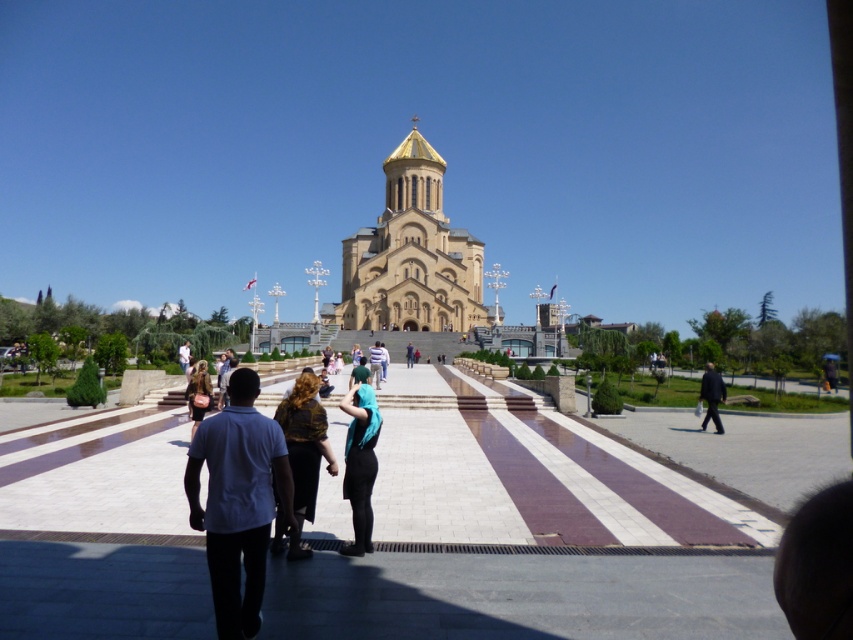
Question: Does gold textured dress at center appear over dark blue fabric jacket at center?

Choices:
 (A) yes
 (B) no

Answer: (B)

Question: In this image, where is beige stone church at center located relative to white cotton shirt at center?

Choices:
 (A) above
 (B) below

Answer: (A)

Question: Considering the real-world distances, which object is farthest from the dark blue fabric jacket at center?

Choices:
 (A) gold textured dress at center
 (B) beige stone church at center

Answer: (A)

Question: Which is farther from the dark blue fabric jacket at center?

Choices:
 (A) white cotton shirt at center
 (B) black suit at right
 (C) striped shirt at center

Answer: (A)

Question: Is the position of matte black dress at center less distant than that of light brown leather jacket at center?

Choices:
 (A) no
 (B) yes

Answer: (B)

Question: Which object is the farthest from the beige stone church at center?

Choices:
 (A) striped shirt at center
 (B) white cotton shirt at center
 (C) black suit at right
 (D) dark blue fabric at center

Answer: (B)